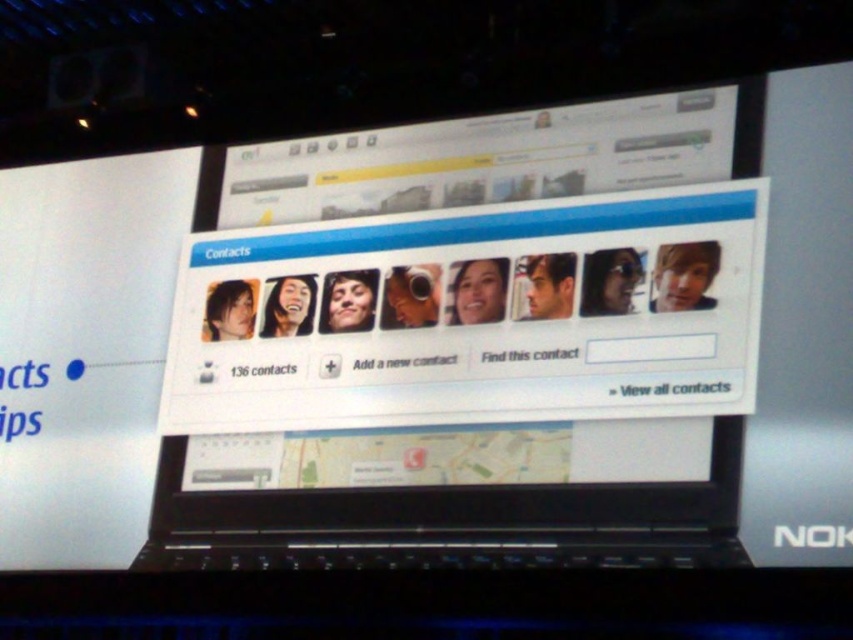
You are using a laptop and want to click on one of the two points displayed on the screen. The first point is at coordinate point (606,268) and the second is at coordinate point (802,532). Since both points are on the screen, which one do you think is closer to the bottom edge of the laptop screen?

Point (802,532) is closer to the bottom edge of the laptop screen because its y coordinate is higher than point (606,268).

You are setting up a new workspace and have a desk that can only accommodate items up to 30 cm in width. You need to place both the black plastic laptop at center and the black plastic nokia logo at center on the desk. Based on the image, will both items fit side by side without exceeding the desk width limit?

The black plastic laptop at center has a lesser width compared to black plastic nokia logo at center. However, since the exact widths are not provided, we cannot definitively determine if their combined width exceeds 30 cm. Additional measurements would be needed to confirm.

You are setting up a new laptop and notice the black plastic laptop at center and the black plastic nokia logo at center. Which one is located to the left?

The black plastic laptop at center is positioned on the left side of black plastic nokia logo at center, so the black plastic laptop at center is located to the left.